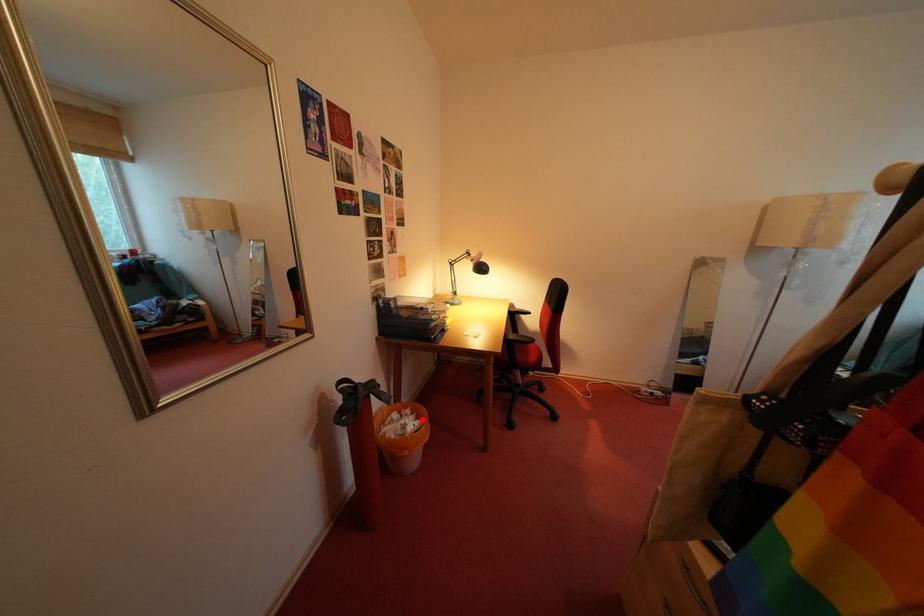
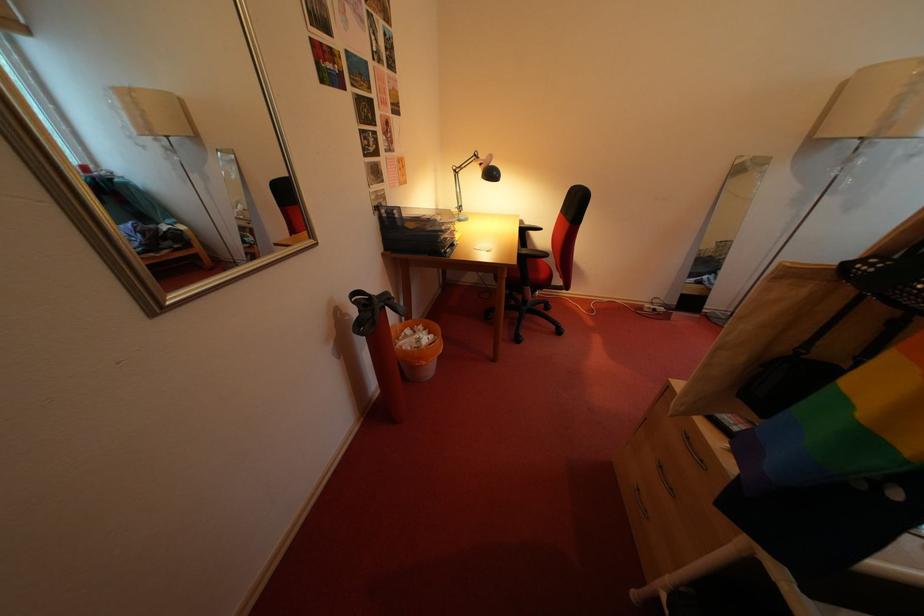
Question: I am providing you with two images of the same scene from different viewpoints. In image1, a red point is highlighted. Considering the same 3D point in image2, which of the following is correct?

Choices:
 (A) It is closer
 (B) It is farther

Answer: (B)